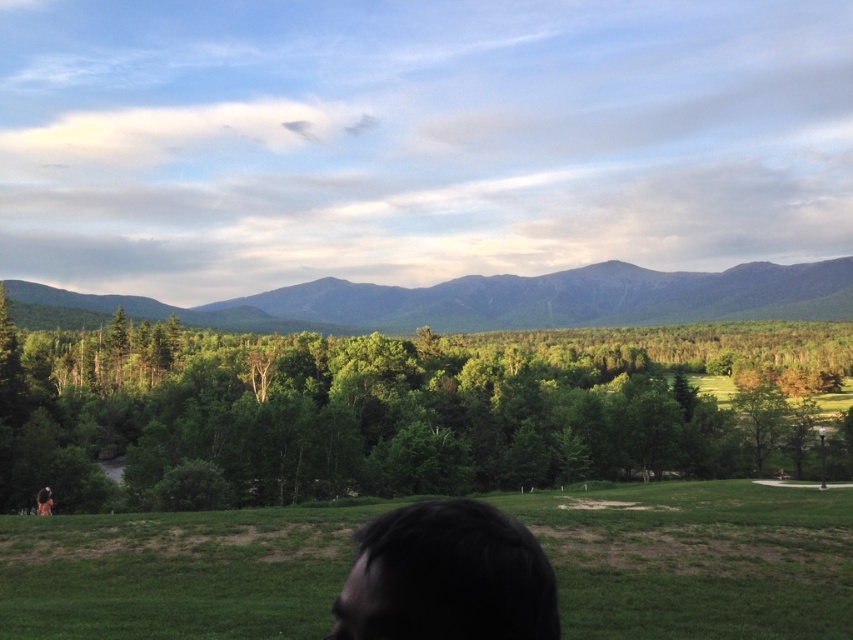
Does green leafy trees at center have a lesser width compared to black hair at lower center?

Incorrect, green leafy trees at center's width is not less than black hair at lower center's.

The image size is (853, 640). What do you see at coordinates (392, 410) in the screenshot?
I see `green leafy trees at center` at bounding box center [392, 410].

Does point (381, 413) lie behind point (432, 580)?

Yes, point (381, 413) is farther from viewer.

The width and height of the screenshot is (853, 640). Identify the location of green leafy trees at center. (392, 410).

Is black hair at lower center bigger than dark brown hair at lower center?

Actually, black hair at lower center might be smaller than dark brown hair at lower center.

Can you confirm if black hair at lower center is shorter than dark brown hair at lower center?

Indeed, black hair at lower center has a lesser height compared to dark brown hair at lower center.

You are a GUI agent. You are given a task and a screenshot of the screen. Output one action in this format:
    pyautogui.click(x=<x>, y=<y>)
    Task: Click on the black hair at lower center
    The width and height of the screenshot is (853, 640).
    Given the screenshot: What is the action you would take?
    pyautogui.click(x=447, y=577)

Is point (711, 508) positioned before point (433, 636)?

That is False.

Locate an element on the screen. green grassy field at lower center is located at coordinates (697, 560).